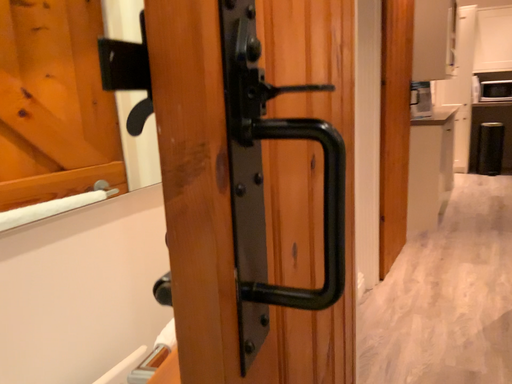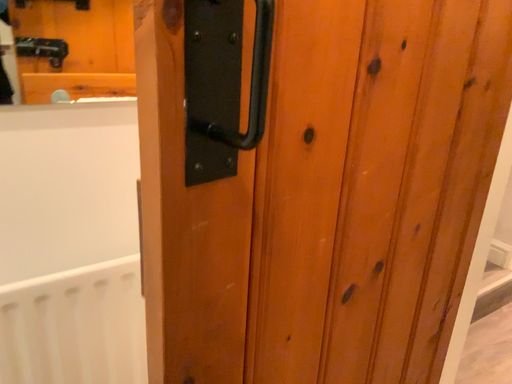
Question: Which way did the camera rotate in the video?

Choices:
 (A) rotated left
 (B) rotated right

Answer: (A)